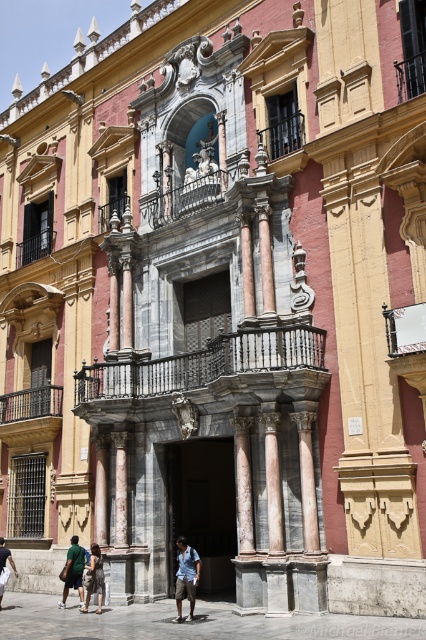
Is point (193, 580) positioned in front of point (69, 568)?

Yes, point (193, 580) is closer to viewer.

Which of these two, light blue denim shorts at lower center or green cotton shorts at lower left, stands taller?

With more height is light blue denim shorts at lower center.

The width and height of the screenshot is (426, 640). What do you see at coordinates (186, 577) in the screenshot?
I see `light blue denim shorts at lower center` at bounding box center [186, 577].

Identify the location of light blue denim shorts at lower center. (186, 577).

Between green cotton shorts at lower left and light brown fabric dress at lower center, which one is positioned higher?

light brown fabric dress at lower center is higher up.

Between green cotton shorts at lower left and light brown fabric dress at lower center, which one has more height?

With more height is green cotton shorts at lower left.

Does point (75, 536) lie in front of point (91, 577)?

No, it is behind (91, 577).

Identify the location of green cotton shorts at lower left. The width and height of the screenshot is (426, 640). (74, 572).

Between light blue denim shorts at lower center and light brown fabric dress at lower center, which one appears on the right side from the viewer's perspective?

From the viewer's perspective, light blue denim shorts at lower center appears more on the right side.

Is light blue denim shorts at lower center above light brown fabric dress at lower center?

Incorrect, light blue denim shorts at lower center is not positioned above light brown fabric dress at lower center.

Measure the distance between point (181, 557) and camera.

Point (181, 557) is 136.68 feet from camera.

Where is `light blue denim shorts at lower center`? This screenshot has height=640, width=426. light blue denim shorts at lower center is located at coordinates (186, 577).